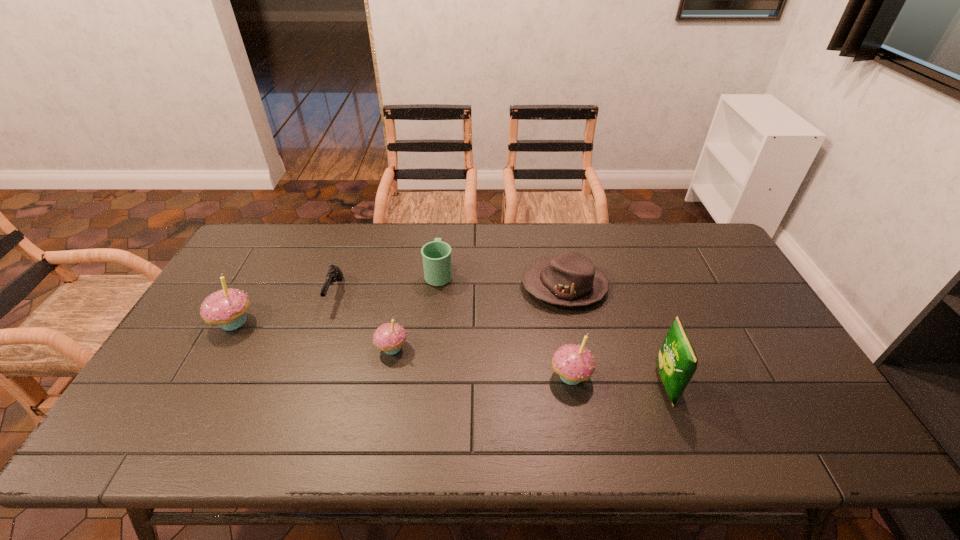
You are a GUI agent. You are given a task and a screenshot of the screen. Output one action in this format:
    pyautogui.click(x=<x>, y=<y>)
    Task: Click on the free space for a new cupcake on the right
    
    Given the screenshot: What is the action you would take?
    pyautogui.click(x=772, y=408)